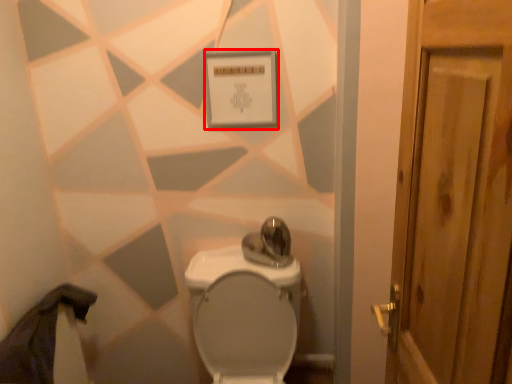
Question: From the image's perspective, considering the relative positions of square (annotated by the red box) and toilet in the image provided, where is square (annotated by the red box) located with respect to the staircase?

Choices:
 (A) above
 (B) below

Answer: (A)